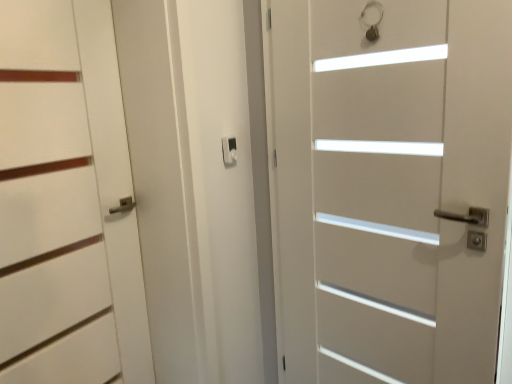
Question: From the image's perspective, is white matte door at center, the first door in the right-to-left sequence, over white matte door at left, positioned as the second door in right-to-left order?

Choices:
 (A) yes
 (B) no

Answer: (B)

Question: Is white matte door at center, the first door in the right-to-left sequence, not near white matte door at left, which ranks as the 1th door in left-to-right order?

Choices:
 (A) yes
 (B) no

Answer: (B)

Question: Is white matte door at center, which is counted as the 2th door, starting from the left, in contact with white matte door at left, positioned as the second door in right-to-left order?

Choices:
 (A) yes
 (B) no

Answer: (B)

Question: From a real-world perspective, is white matte door at center, the first door in the right-to-left sequence, over white matte door at left, which ranks as the 1th door in left-to-right order?

Choices:
 (A) yes
 (B) no

Answer: (B)

Question: Is white matte door at center, the first door in the right-to-left sequence, closer to the viewer compared to white matte door at left, which ranks as the 1th door in left-to-right order?

Choices:
 (A) yes
 (B) no

Answer: (A)

Question: In terms of height, does white matte door at left, which ranks as the 1th door in left-to-right order, look taller or shorter compared to white matte door at center, which is counted as the 2th door, starting from the left?

Choices:
 (A) tall
 (B) short

Answer: (B)

Question: In terms of width, does white matte door at left, positioned as the second door in right-to-left order, look wider or thinner when compared to white matte door at center, which is counted as the 2th door, starting from the left?

Choices:
 (A) wide
 (B) thin

Answer: (B)

Question: Would you say white matte door at left, positioned as the second door in right-to-left order, is inside or outside white matte door at center, the first door in the right-to-left sequence?

Choices:
 (A) outside
 (B) inside

Answer: (A)

Question: Considering their positions, is white matte door at left, positioned as the second door in right-to-left order, located in front of or behind white matte door at center, which is counted as the 2th door, starting from the left?

Choices:
 (A) behind
 (B) front

Answer: (A)

Question: Do you think white matte door at left, positioned as the second door in right-to-left order, is within matte black latch at center, or outside of it?

Choices:
 (A) outside
 (B) inside

Answer: (A)

Question: From the image's perspective, is white matte door at left, positioned as the second door in right-to-left order, located above or below matte black latch at center?

Choices:
 (A) above
 (B) below

Answer: (B)

Question: Considering the relative positions of white matte door at left, positioned as the second door in right-to-left order, and matte black latch at center in the image provided, is white matte door at left, positioned as the second door in right-to-left order, to the left or to the right of matte black latch at center?

Choices:
 (A) right
 (B) left

Answer: (B)

Question: Based on their sizes in the image, would you say white matte door at left, positioned as the second door in right-to-left order, is bigger or smaller than matte black latch at center?

Choices:
 (A) big
 (B) small

Answer: (A)

Question: Is matte black latch at center to the left or to the right of white matte door at left, which ranks as the 1th door in left-to-right order, in the image?

Choices:
 (A) left
 (B) right

Answer: (B)

Question: From the image's perspective, is matte black latch at center above or below white matte door at left, positioned as the second door in right-to-left order?

Choices:
 (A) above
 (B) below

Answer: (A)